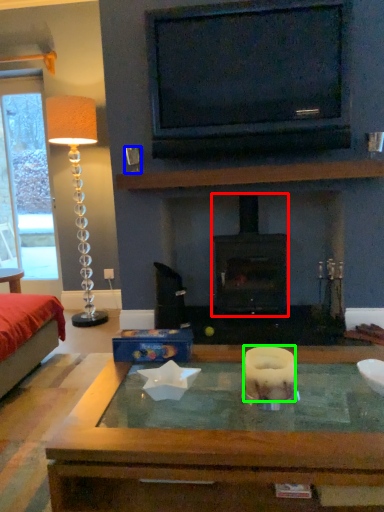
Question: Which object is the farthest from wood burning stove (highlighted by a red box)? Choose among these: coffee cup (highlighted by a blue box) or candle (highlighted by a green box).

Choices:
 (A) coffee cup
 (B) candle

Answer: (B)